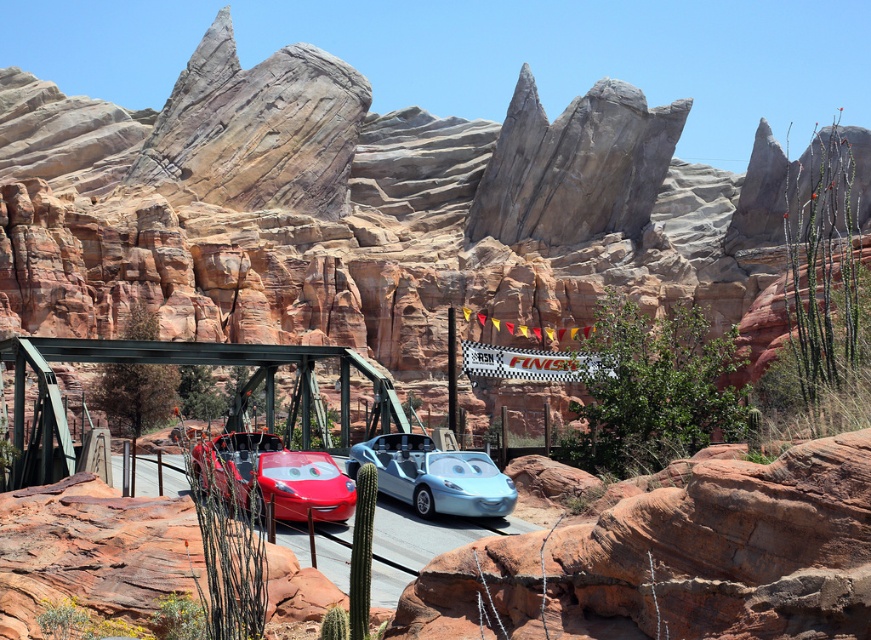
Can you confirm if glossy red car at center is positioned above shiny metallic car at center?

Actually, glossy red car at center is below shiny metallic car at center.

Is point (244, 488) in front of point (456, 460)?

Yes, it is.

The height and width of the screenshot is (640, 871). Identify the location of glossy red car at center. (274, 476).

Consider the image. Can you confirm if metallic steel bridge at center is positioned below glossy red car at center?

No, metallic steel bridge at center is not below glossy red car at center.

The height and width of the screenshot is (640, 871). Identify the location of metallic steel bridge at center. (194, 364).

Find the location of a particular element. This screenshot has width=871, height=640. metallic steel bridge at center is located at coordinates (194, 364).

Between point (343, 435) and point (450, 484), which one is positioned in front?

Point (450, 484)

Which of these two, metallic steel bridge at center or shiny metallic car at center, stands shorter?

With less height is shiny metallic car at center.

I want to click on metallic steel bridge at center, so click(x=194, y=364).

Locate an element on the screen. This screenshot has width=871, height=640. metallic steel bridge at center is located at coordinates (194, 364).